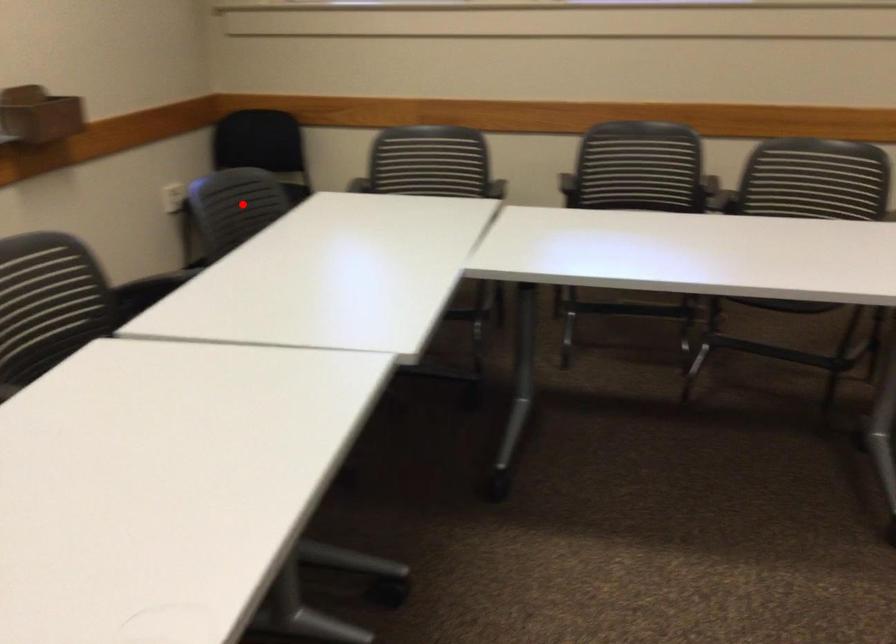
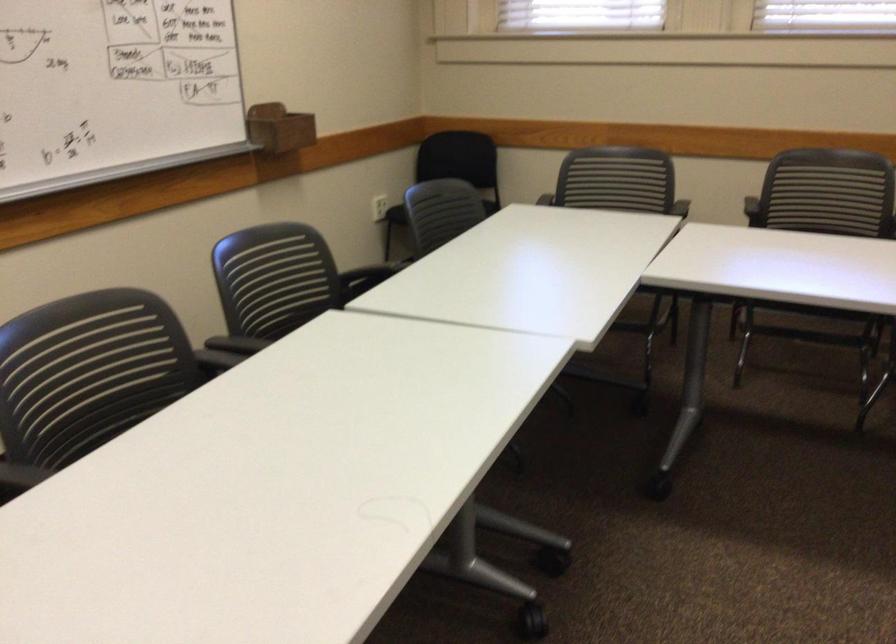
The point at the highlighted location is marked in the first image. Where is the corresponding point in the second image?

(441, 212)